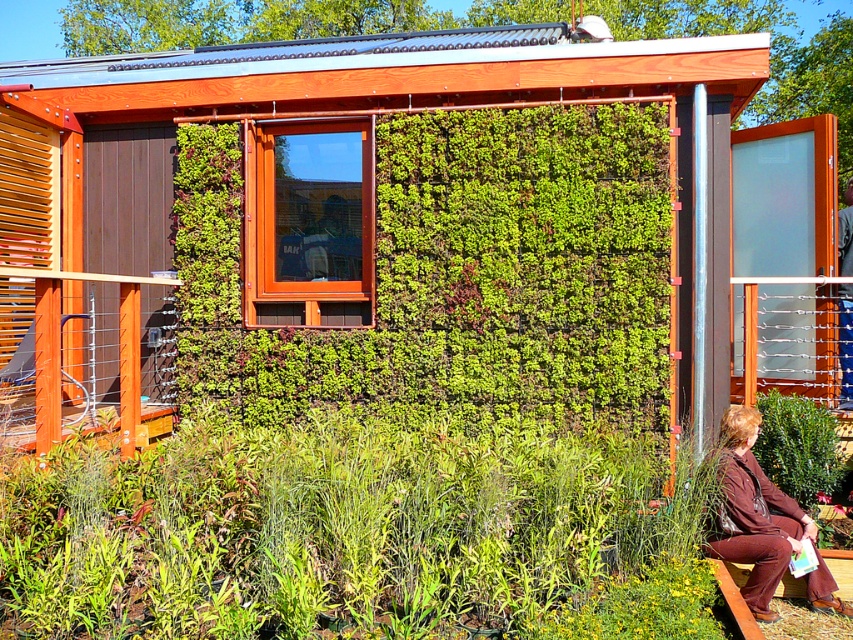
You are a visitor approaching the building and want to see both the green leafy hedge at center and the brown fabric at lower right. Which object will be visible first as you walk towards the building?

The green leafy hedge at center will be visible first because the brown fabric at lower right is positioned behind it.

You are designing a garden layout and need to place a new decorative stone path. The path must be wide enough to accommodate a 2.5 meter wide truck. Given the green leafy hedge at center and the brown fabric at lower right, which object can you use as a reference to ensure the path is wide enough?

The green leafy hedge at center has a larger width than the brown fabric at lower right. Since the truck requires a 2.5 meter width, you should use the green leafy hedge at center as a reference because its width is greater, ensuring the path meets the required clearance.